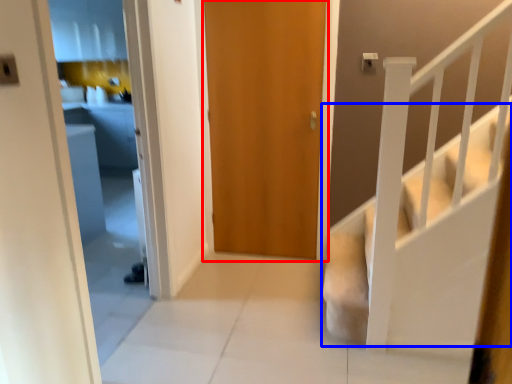
Question: Which point is further to the camera, door (highlighted by a red box) or stairs (highlighted by a blue box)?

Choices:
 (A) door
 (B) stairs

Answer: (A)